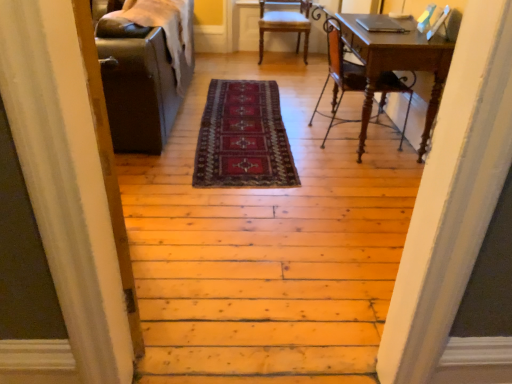
This screenshot has height=384, width=512. What are the coordinates of `free space between wooden chair at center, arranged as the 1th chair when viewed from the back, and dark red woven rug at center` in the screenshot? It's located at click(278, 79).